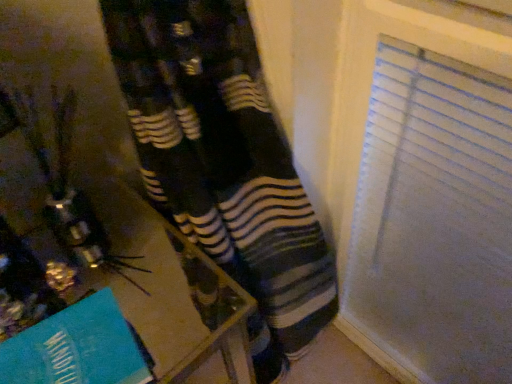
Question: Is wooden table at lower left to the right of teal paper at lower left from the viewer's perspective?

Choices:
 (A) yes
 (B) no

Answer: (A)

Question: Is wooden table at lower left outside teal paper at lower left?

Choices:
 (A) yes
 (B) no

Answer: (A)

Question: Is wooden table at lower left facing away from teal paper at lower left?

Choices:
 (A) yes
 (B) no

Answer: (B)

Question: Is wooden table at lower left not close to teal paper at lower left?

Choices:
 (A) no
 (B) yes

Answer: (A)

Question: Does wooden table at lower left have a smaller size compared to teal paper at lower left?

Choices:
 (A) no
 (B) yes

Answer: (A)

Question: Could you tell me if wooden table at lower left is facing teal paper at lower left?

Choices:
 (A) yes
 (B) no

Answer: (B)

Question: Are teal paper at lower left and wooden table at lower left beside each other?

Choices:
 (A) no
 (B) yes

Answer: (A)

Question: Would you say teal paper at lower left contains wooden table at lower left?

Choices:
 (A) yes
 (B) no

Answer: (B)

Question: Is teal paper at lower left aimed at wooden table at lower left?

Choices:
 (A) no
 (B) yes

Answer: (A)

Question: Are teal paper at lower left and wooden table at lower left located far from each other?

Choices:
 (A) yes
 (B) no

Answer: (B)

Question: Does teal paper at lower left have a lesser height compared to wooden table at lower left?

Choices:
 (A) no
 (B) yes

Answer: (B)

Question: Is teal paper at lower left facing away from wooden table at lower left?

Choices:
 (A) no
 (B) yes

Answer: (A)

Question: From their relative heights in the image, would you say wooden table at lower left is taller or shorter than teal paper at lower left?

Choices:
 (A) short
 (B) tall

Answer: (B)